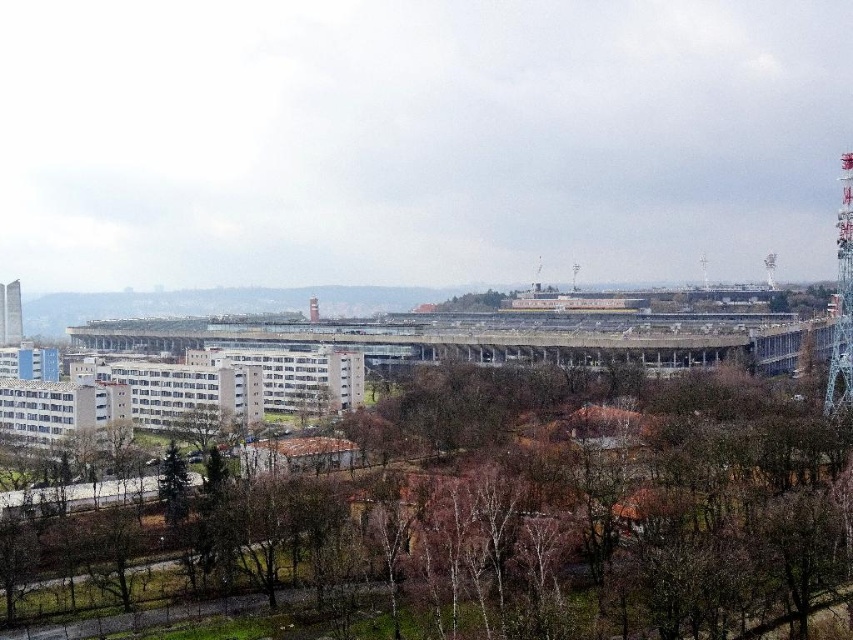
Question: Is smooth concrete tower at left below smooth red tower at center?

Choices:
 (A) no
 (B) yes

Answer: (B)

Question: Which object is positioned farthest from the smooth red tower at center?

Choices:
 (A) brown leafless tree at center
 (B) smooth concrete tower at left
 (C) metallic lattice tower at right

Answer: (A)

Question: Does smooth concrete tower at left appear over smooth red tower at center?

Choices:
 (A) yes
 (B) no

Answer: (B)

Question: Can you confirm if brown leafless tree at center is positioned to the right of smooth concrete tower at left?

Choices:
 (A) no
 (B) yes

Answer: (B)

Question: Based on their relative distances, which object is nearer to the smooth red tower at center?

Choices:
 (A) smooth concrete tower at left
 (B) brown leafless tree at center
 (C) metallic lattice tower at right

Answer: (A)

Question: Among these objects, which one is nearest to the camera?

Choices:
 (A) brown leafless tree at center
 (B) smooth concrete tower at left

Answer: (A)